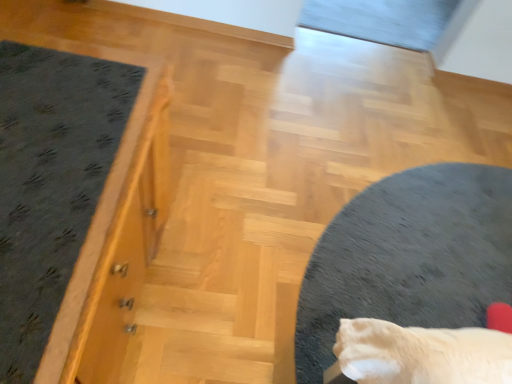
Question: Is dark gray carpet at left wider or thinner than soft gray carpet at center?

Choices:
 (A) thin
 (B) wide

Answer: (A)

Question: From a real-world perspective, relative to soft gray carpet at center, is dark gray carpet at left vertically above or below?

Choices:
 (A) above
 (B) below

Answer: (A)

Question: Based on their sizes in the image, would you say dark gray carpet at left is bigger or smaller than soft gray carpet at center?

Choices:
 (A) small
 (B) big

Answer: (B)

Question: Is point (408, 284) positioned closer to the camera than point (42, 205)?

Choices:
 (A) farther
 (B) closer

Answer: (A)

Question: Looking at their shapes, would you say soft gray carpet at center is wider or thinner than dark gray carpet at left?

Choices:
 (A) thin
 (B) wide

Answer: (B)

Question: Looking at the image, does soft gray carpet at center seem bigger or smaller compared to dark gray carpet at left?

Choices:
 (A) small
 (B) big

Answer: (A)

Question: From the image's perspective, relative to dark gray carpet at left, is soft gray carpet at center above or below?

Choices:
 (A) above
 (B) below

Answer: (B)